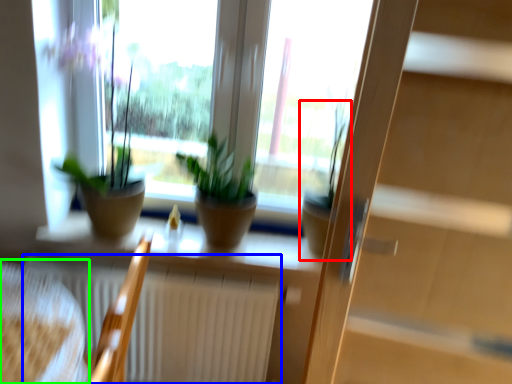
Question: Estimate the real-world distances between objects in this image. Which object is closer to houseplant (highlighted by a red box), radiator (highlighted by a blue box) or armchair (highlighted by a green box)?

Choices:
 (A) radiator
 (B) armchair

Answer: (A)